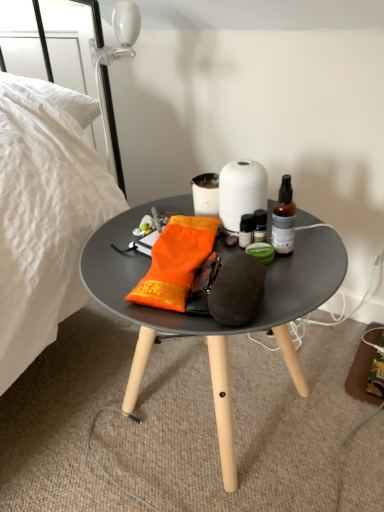
Find the location of `vacant area that is in front of brown glass bottle at center`. vacant area that is in front of brown glass bottle at center is located at coordinates (293, 284).